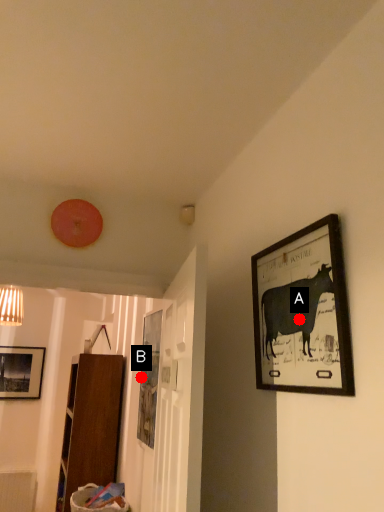
Question: Two points are circled on the image, labeled by A and B beside each circle. Which point is further to the camera?

Choices:
 (A) A is further
 (B) B is further

Answer: (B)